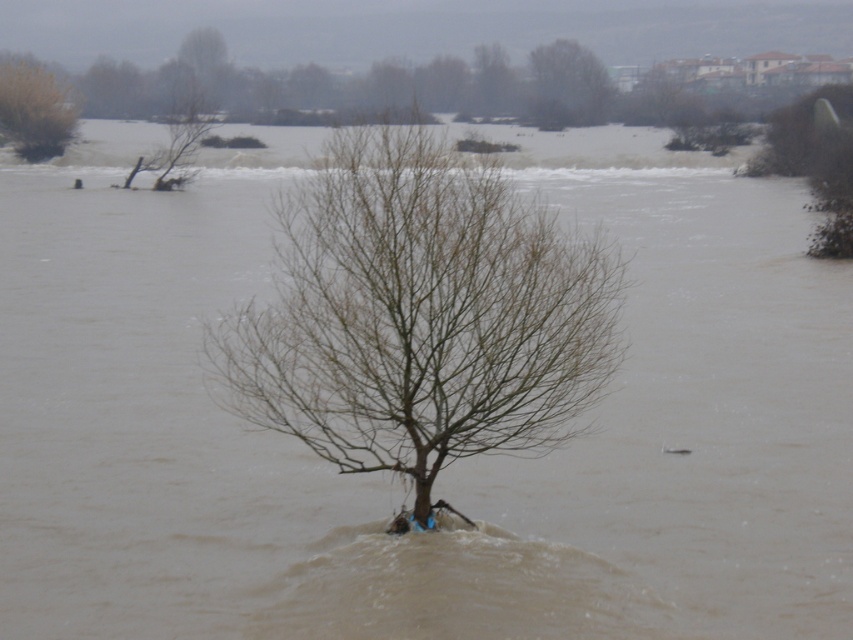
Can you confirm if brown matte tree at center is thinner than brown leafless tree at upper left?

Incorrect, brown matte tree at center's width is not less than brown leafless tree at upper left's.

Which of these two, brown matte tree at center or brown leafless tree at upper left, stands shorter?

With less height is brown leafless tree at upper left.

You are a GUI agent. You are given a task and a screenshot of the screen. Output one action in this format:
    pyautogui.click(x=<x>, y=<y>)
    Task: Click on the brown matte tree at center
    The height and width of the screenshot is (640, 853).
    Given the screenshot: What is the action you would take?
    pyautogui.click(x=421, y=316)

The image size is (853, 640). What are the coordinates of `brown leafless tree at upper left` in the screenshot? It's located at (33, 109).

Does point (61, 136) lie behind point (555, 49)?

No, it is in front of (555, 49).

At what (x,y) coordinates should I click in order to perform the action: click on brown leafless tree at upper left. Please return your answer as a coordinate pair (x, y). The height and width of the screenshot is (640, 853). Looking at the image, I should click on (33, 109).

Find the location of a particular element. The height and width of the screenshot is (640, 853). brown leafless tree at upper left is located at coordinates (33, 109).

Is point (590, 360) positioned behind point (595, 90)?

No.

Which is in front, point (392, 257) or point (595, 67)?

Point (392, 257) is in front.

Does point (468, 276) lie behind point (585, 88)?

That is False.

This screenshot has width=853, height=640. What are the coordinates of `brown matte tree at center` in the screenshot? It's located at (421, 316).